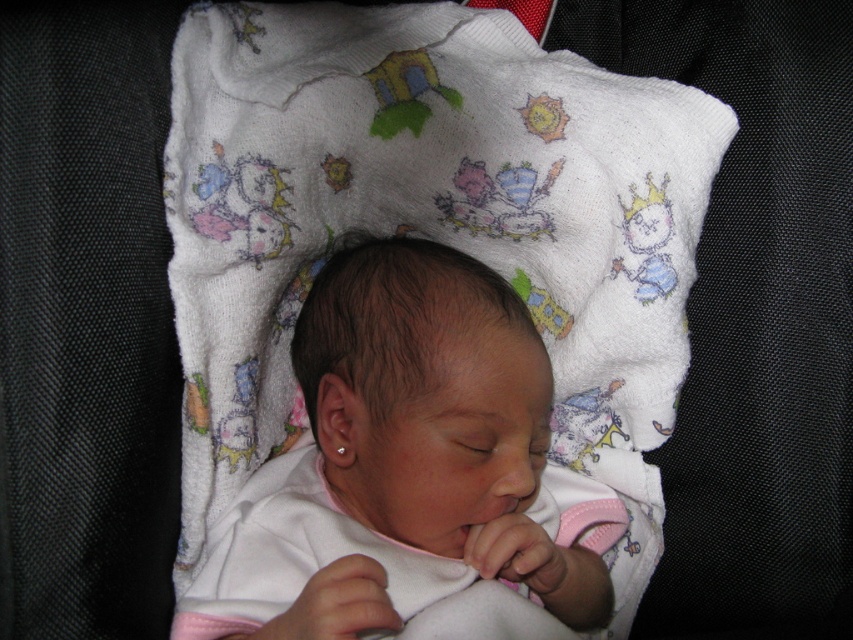
Which is above, smooth pink fabric at center or clear plastic teething ring at center?

smooth pink fabric at center is higher up.

Between smooth pink fabric at center and clear plastic teething ring at center, which one is positioned lower?

clear plastic teething ring at center is lower down.

Identify the location of smooth pink fabric at center. (399, 458).